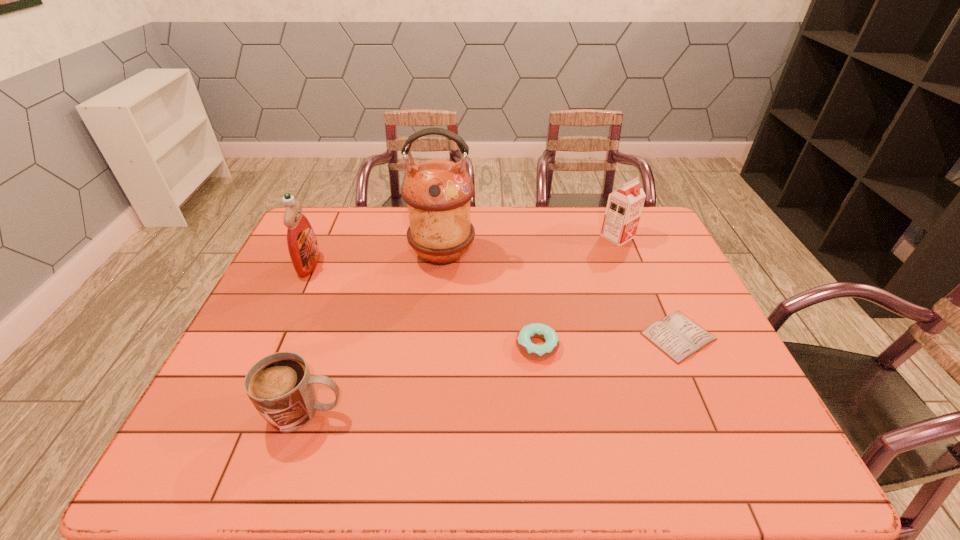
You are a GUI agent. You are given a task and a screenshot of the screen. Output one action in this format:
    pyautogui.click(x=<x>, y=<y>)
    Task: Click on the tallest object
    The height and width of the screenshot is (540, 960).
    Given the screenshot: What is the action you would take?
    pyautogui.click(x=438, y=192)

I want to click on oil lamp, so click(438, 192).

Locate an element on the screen. This screenshot has height=540, width=960. detergent is located at coordinates (302, 244).

Locate an element on the screen. soya milk is located at coordinates (624, 206).

Locate an element on the screen. Image resolution: width=960 pixels, height=540 pixels. the nearest object is located at coordinates (280, 386).

Identify the location of mug. (280, 386).

Image resolution: width=960 pixels, height=540 pixels. Identify the location of the fourth object from left to right. pos(538,352).

What are the coordinates of `doughnut` in the screenshot? It's located at (538, 352).

The height and width of the screenshot is (540, 960). In order to click on diary in this screenshot , I will do tap(677, 336).

The image size is (960, 540). I want to click on vacant area located 0.130m on the left of the fourth object from right to left, so click(x=369, y=255).